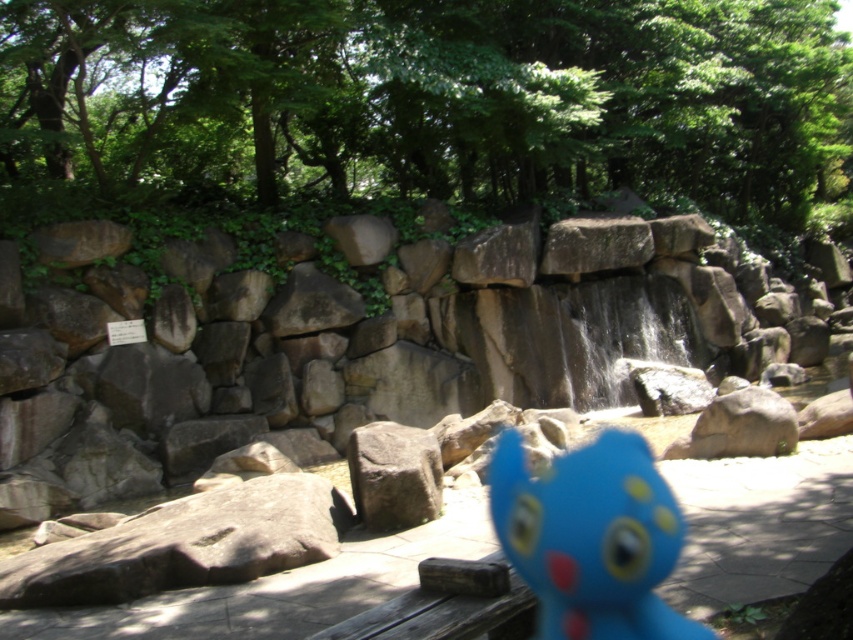
Question: Is green leafy tree at upper center smaller than blue rubber toy at center?

Choices:
 (A) no
 (B) yes

Answer: (A)

Question: Observing the image, what is the correct spatial positioning of green leafy tree at upper center in reference to blue rubber toy at center?

Choices:
 (A) below
 (B) above

Answer: (B)

Question: Is green leafy tree at upper center bigger than blue rubber toy at center?

Choices:
 (A) yes
 (B) no

Answer: (A)

Question: Which point is farther to the camera?

Choices:
 (A) (699, 74)
 (B) (605, 592)

Answer: (A)